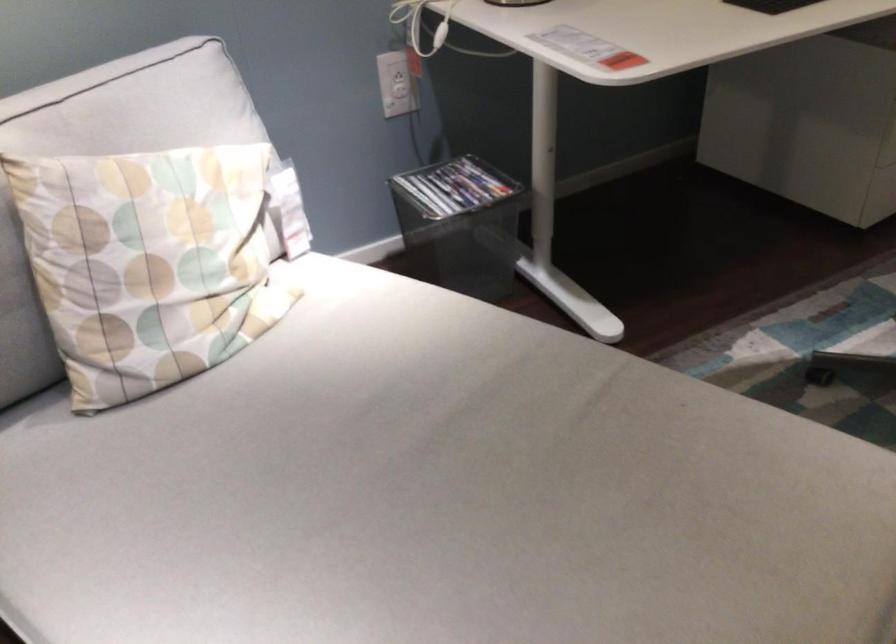
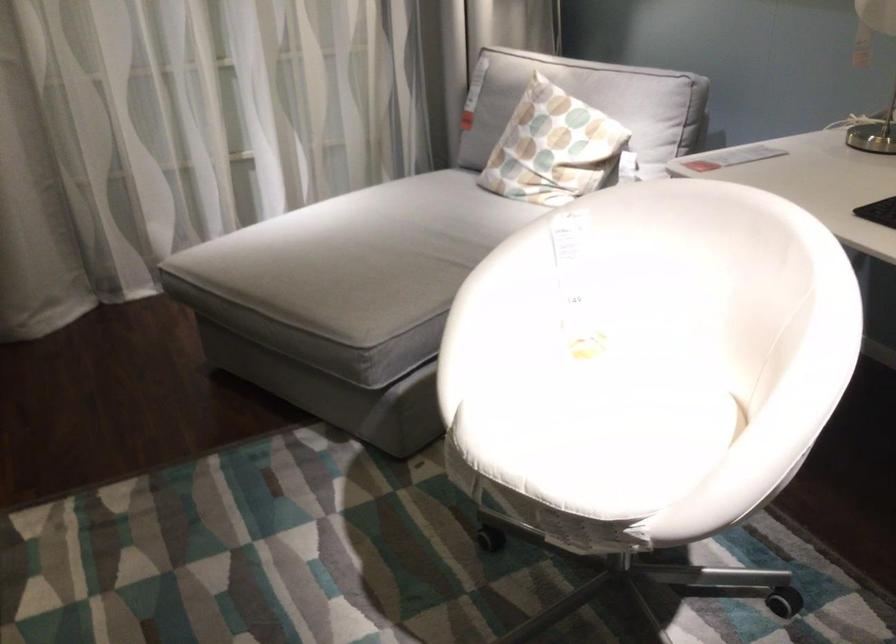
Question: I am providing you with two images of the same scene from different viewpoints. Please identify which objects are invisible in image2.

Choices:
 (A) magazine in bin
 (B) patterned pillow
 (C) white chair armrest
 (D) microwave button

Answer: (A)